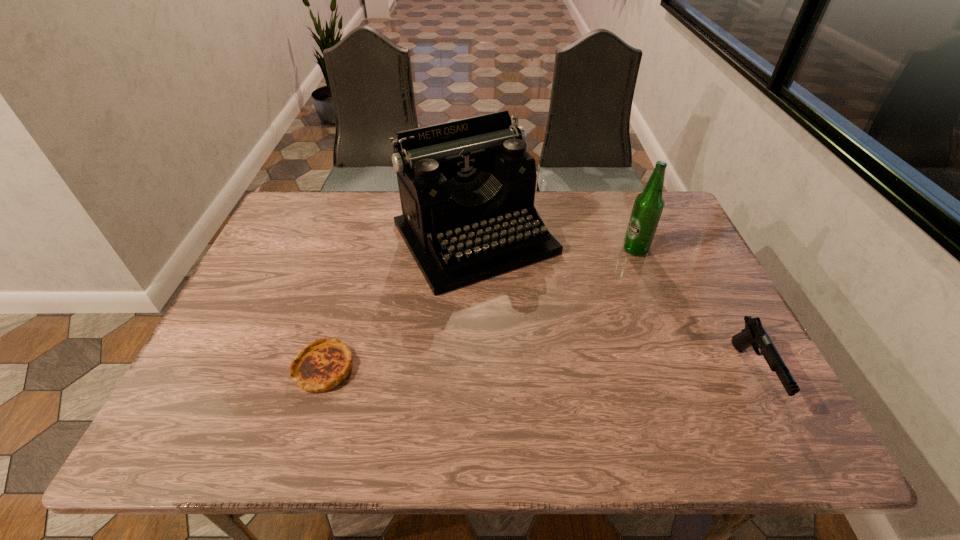
The height and width of the screenshot is (540, 960). In order to click on free region at the near edge in this screenshot , I will do `click(554, 372)`.

Identify the location of vacant space at the left edge of the desktop. This screenshot has height=540, width=960. (229, 335).

Identify the location of vacant region at the right edge of the desktop. This screenshot has width=960, height=540. (653, 251).

This screenshot has width=960, height=540. I want to click on free location at the far left corner, so click(x=333, y=217).

The image size is (960, 540). I want to click on vacant space at the far right corner of the desktop, so 677,218.

The height and width of the screenshot is (540, 960). Identify the location of free space at the near right corner of the desktop. (746, 381).

Where is `free space between the leftmost object and the typewriter`? This screenshot has height=540, width=960. free space between the leftmost object and the typewriter is located at coordinates (399, 303).

Find the location of a particular element. free space between the quiche and the second shortest object is located at coordinates (538, 370).

I want to click on vacant point located between the quiche and the beer bottle, so click(479, 308).

Locate an element on the screen. vacant area that lies between the shortest object and the gun is located at coordinates (538, 370).